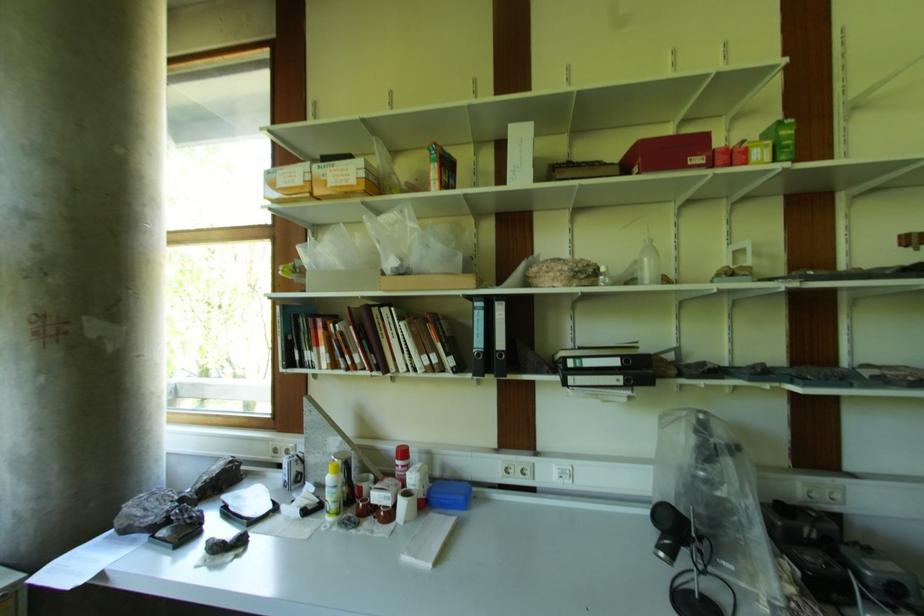
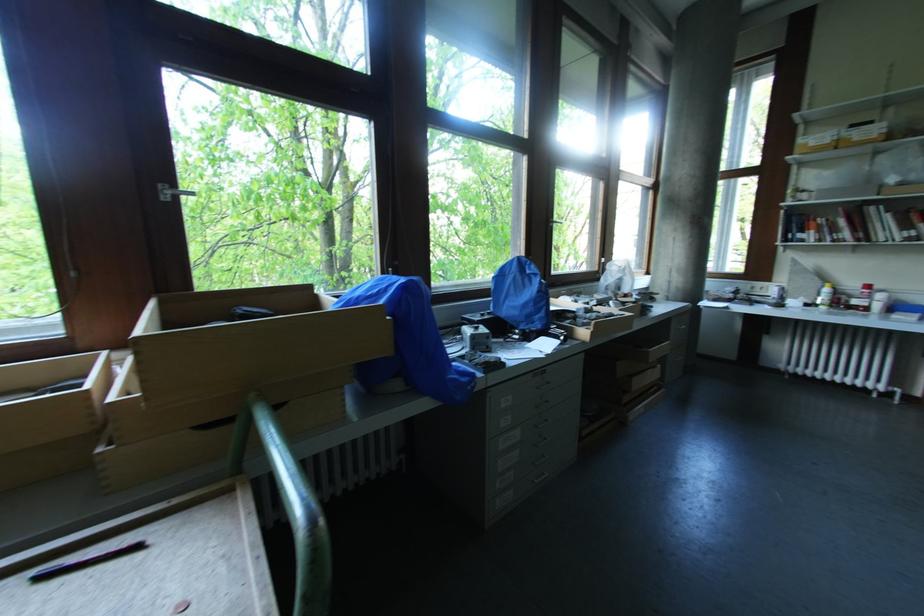
Locate, in the second image, the point that corresponds to the point at 407,454 in the first image.

(871, 288)